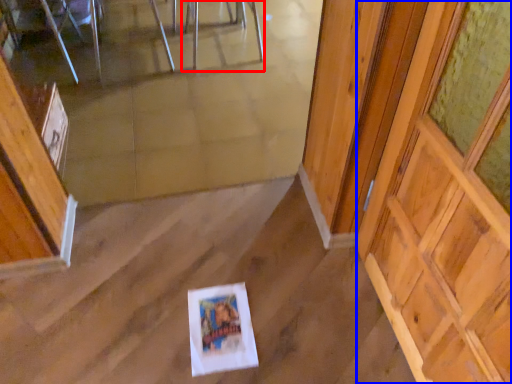
Question: Among these objects, which one is nearest to the camera, chair (highlighted by a red box) or barn door (highlighted by a blue box)?

Choices:
 (A) chair
 (B) barn door

Answer: (B)